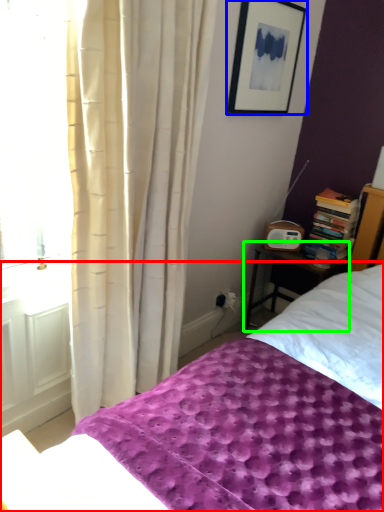
Question: Considering the real-world distances, which object is closest to bed (highlighted by a red box)? picture frame (highlighted by a blue box) or nightstand (highlighted by a green box).

Choices:
 (A) picture frame
 (B) nightstand

Answer: (B)